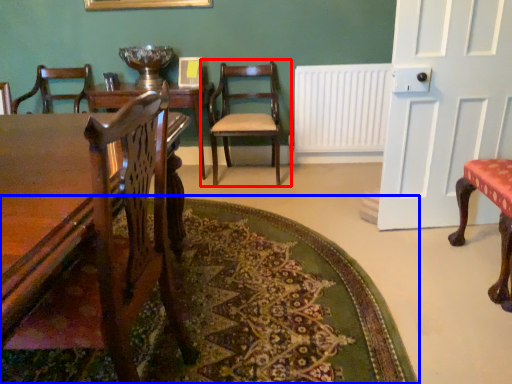
Question: Which object appears closest to the camera in this image, chair (highlighted by a red box) or mat (highlighted by a blue box)?

Choices:
 (A) chair
 (B) mat

Answer: (B)